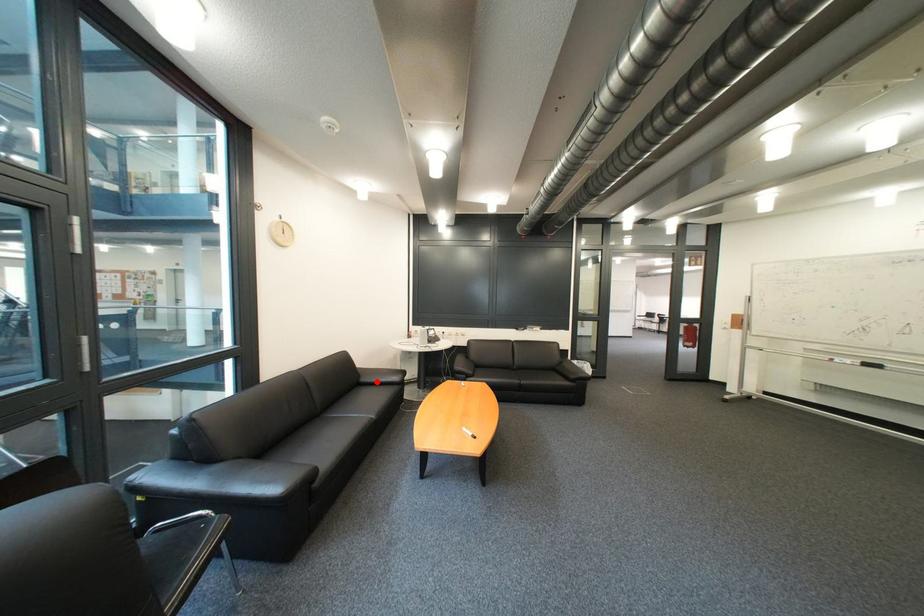
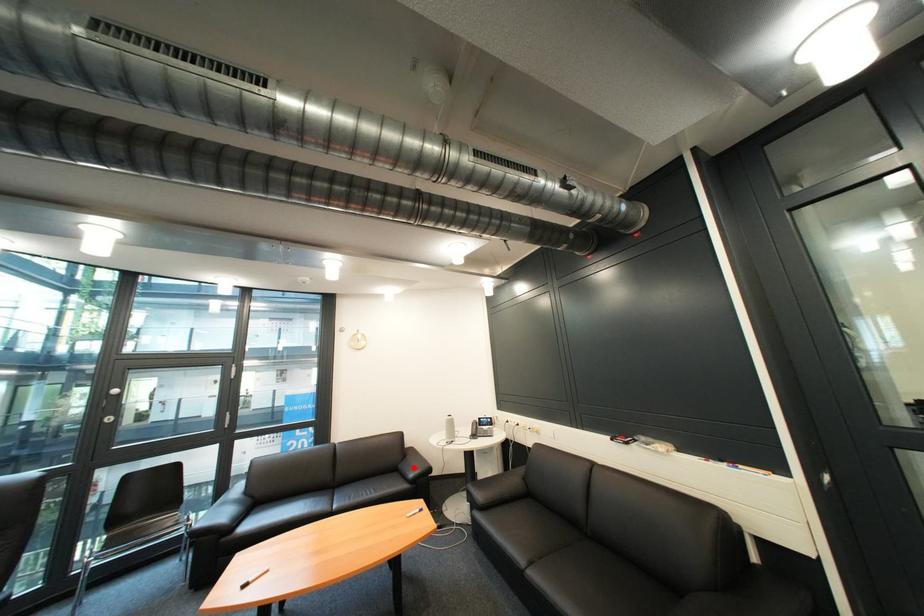
Consider the image. I am providing you with two images of the same scene from different viewpoints. A red point is marked on the first image and another point is marked on the second image. Are the points marked in image1 and image2 representing the same 3D position?

Yes